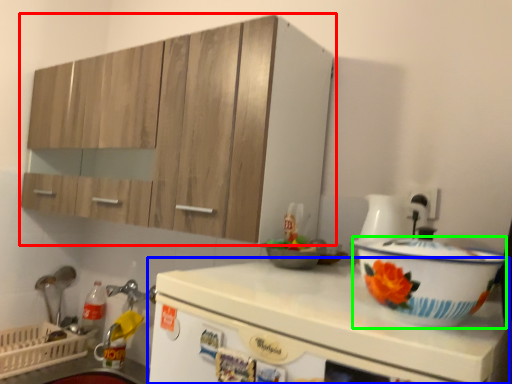
Question: Which object is the closest to the cabinetry (highlighted by a red box)? Choose among these: countertop (highlighted by a blue box) or basin (highlighted by a green box).

Choices:
 (A) countertop
 (B) basin

Answer: (A)